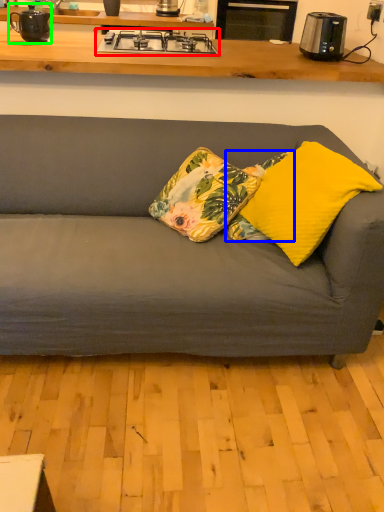
Question: Considering the real-world distances, which object is farthest from gas stove (highlighted by a red box)? pillow (highlighted by a blue box) or appliance (highlighted by a green box)?

Choices:
 (A) pillow
 (B) appliance

Answer: (A)